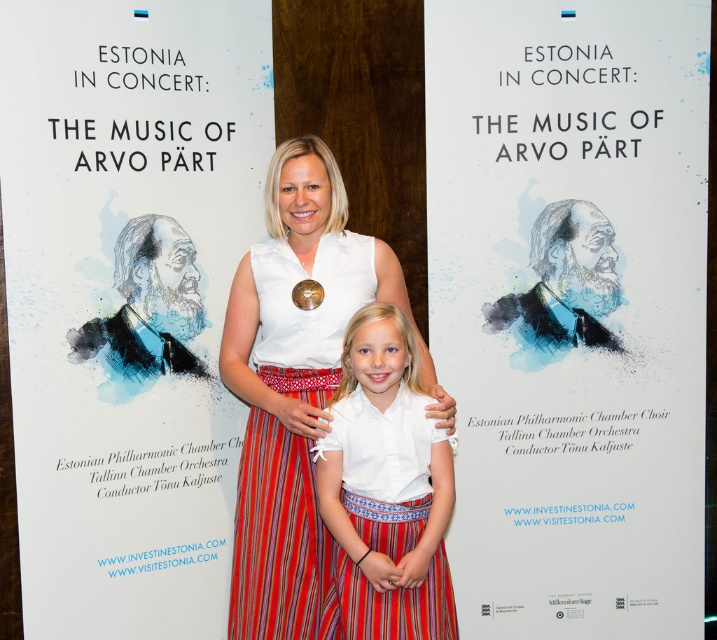
You are an event organizer checking the dress code compliance of attendees at the Estonia in Concert event. You notice two individuals wearing white cotton blouse at center and white cotton shirt at center. Which clothing item is positioned higher on their bodies?

The white cotton blouse at center is located above the white cotton shirt at center, so it is positioned higher on their bodies.

You are an event organizer planning to take a photo of the blue watercolor portrait at center and the white cotton shirt at center for promotional materials. If the camera can only capture objects wider than 30 cm, will both objects fit in the frame?

The blue watercolor portrait at center is wider than the white cotton shirt at center. Since the camera requires objects wider than 30 cm, we need to know the exact width of the portrait. However, the description only states that the portrait is larger in width than the shirt. Without specific measurements, it is impossible to confirm if both meet the 30 cm requirement.